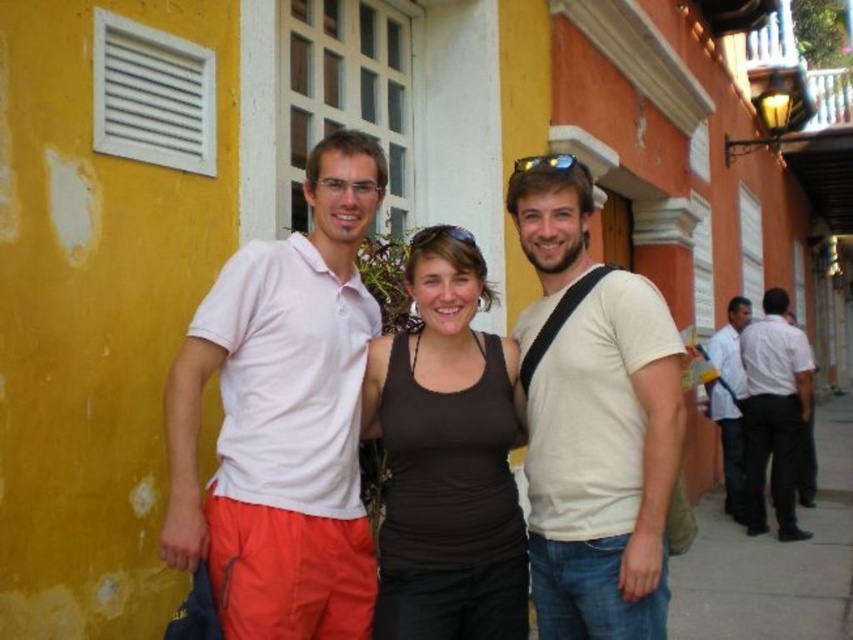
Question: Does white cotton shirt at center have a larger size compared to light beige t-shirt at center?

Choices:
 (A) yes
 (B) no

Answer: (A)

Question: Among these points, which one is farthest from the camera?

Choices:
 (A) (790, 452)
 (B) (254, 284)

Answer: (A)

Question: Is light beige t-shirt at center bigger than white cotton shirt at right?

Choices:
 (A) yes
 (B) no

Answer: (B)

Question: Which point is farther from the camera taking this photo?

Choices:
 (A) (614, 381)
 (B) (842, 506)

Answer: (B)

Question: Which of these objects is positioned closest to the light beige t-shirt at center?

Choices:
 (A) gray concrete sidewalk at lower right
 (B) white cotton shirt at right
 (C) white matte shirt at center

Answer: (C)

Question: Is white matte shirt at center smaller than black matte tank top at center?

Choices:
 (A) yes
 (B) no

Answer: (B)